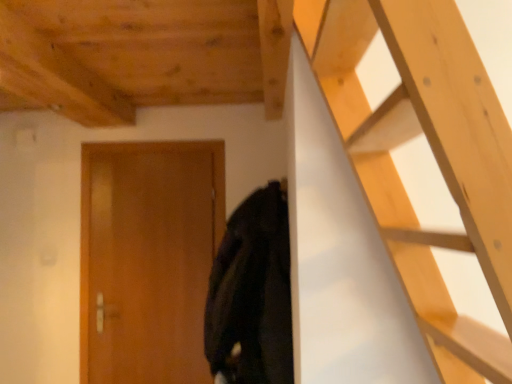
Question: Considering the relative positions of wooden door at center and black matte coat at center in the image provided, is wooden door at center to the right of black matte coat at center from the viewer's perspective?

Choices:
 (A) yes
 (B) no

Answer: (B)

Question: From the image's perspective, does wooden door at center appear higher than black matte coat at center?

Choices:
 (A) no
 (B) yes

Answer: (A)

Question: Is wooden door at center completely or partially outside of black matte coat at center?

Choices:
 (A) yes
 (B) no

Answer: (A)

Question: Can you confirm if wooden door at center is wider than black matte coat at center?

Choices:
 (A) yes
 (B) no

Answer: (B)

Question: From a real-world perspective, is wooden door at center below black matte coat at center?

Choices:
 (A) yes
 (B) no

Answer: (A)

Question: Is black matte coat at center inside wooden door at center?

Choices:
 (A) no
 (B) yes

Answer: (A)

Question: Can you confirm if wooden at upper right is smaller than wooden door at center?

Choices:
 (A) no
 (B) yes

Answer: (A)

Question: Does wooden at upper right turn towards wooden door at center?

Choices:
 (A) no
 (B) yes

Answer: (A)

Question: Is wooden at upper right taller than wooden door at center?

Choices:
 (A) no
 (B) yes

Answer: (A)

Question: Does wooden at upper right appear on the right side of wooden door at center?

Choices:
 (A) yes
 (B) no

Answer: (A)

Question: Can you confirm if wooden at upper right is wider than wooden door at center?

Choices:
 (A) yes
 (B) no

Answer: (A)

Question: From the image's perspective, is wooden at upper right located beneath wooden door at center?

Choices:
 (A) no
 (B) yes

Answer: (A)

Question: Considering the relative sizes of wooden door at center and wooden at upper right in the image provided, is wooden door at center bigger than wooden at upper right?

Choices:
 (A) yes
 (B) no

Answer: (B)